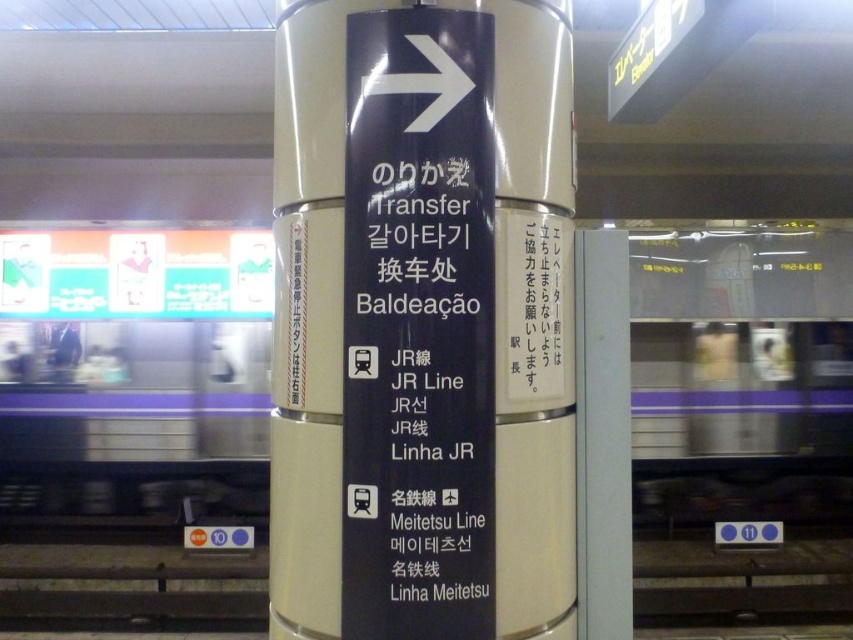
Question: Which point is closer to the camera?

Choices:
 (A) (76, 404)
 (B) (508, 417)
 (C) (451, 365)

Answer: (C)

Question: Can you confirm if black glossy signpost at center is positioned below black plastic sign at center?

Choices:
 (A) no
 (B) yes

Answer: (A)

Question: Which of the following is the closest to the observer?

Choices:
 (A) (321, 632)
 (B) (38, 349)
 (C) (428, 326)

Answer: (C)

Question: Where is black glossy signpost at center located in relation to black plastic sign at center in the image?

Choices:
 (A) above
 (B) below

Answer: (A)

Question: Is black glossy signpost at center below black plastic sign at center?

Choices:
 (A) no
 (B) yes

Answer: (A)

Question: Which object appears closest to the camera in this image?

Choices:
 (A) metallic silver train at center
 (B) black plastic sign at center
 (C) black glossy signpost at center

Answer: (B)